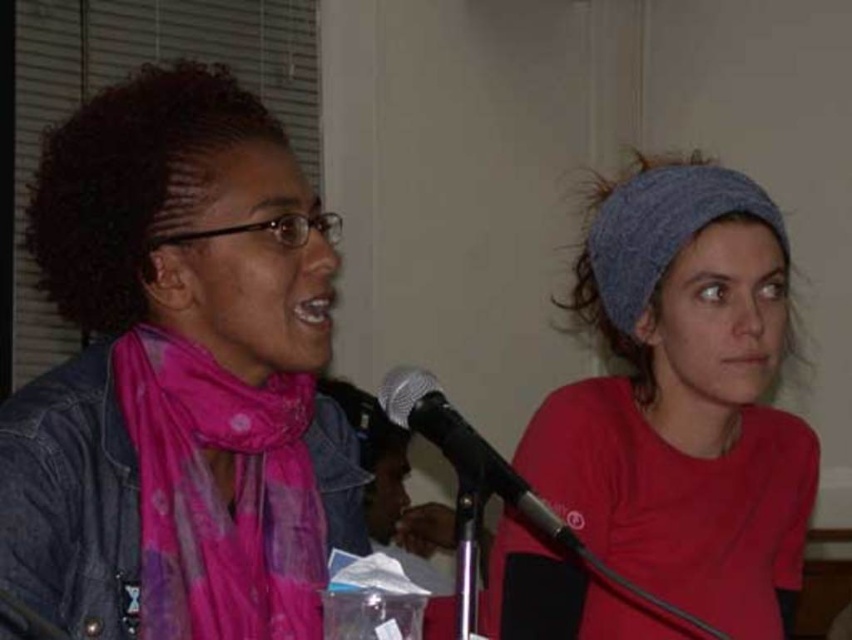
You are an interior designer assessing the placement of items in this room. The pink fabric scarf at left and the black metallic microphone at center are both on the same table. Which object is positioned higher on the table?

The pink fabric scarf at left is much taller than the black metallic microphone at center, so it is positioned higher on the table.

You are organizing a small event and need to decide which item to place in a display case that can only accommodate items smaller than the other. Given the pink fabric scarf at left and the black metallic microphone at center, which item should you choose to fit in the display case?

The black metallic microphone at center should be placed in the display case because it is smaller than the pink fabric scarf at left, which is too large to fit.